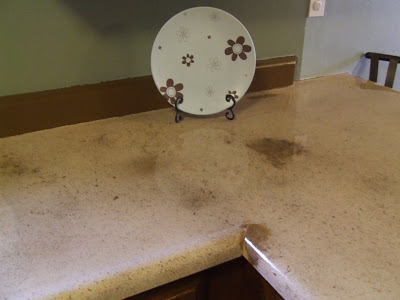
Locate an element on the screen. Image resolution: width=400 pixels, height=300 pixels. chair is located at coordinates (374, 61), (393, 63).